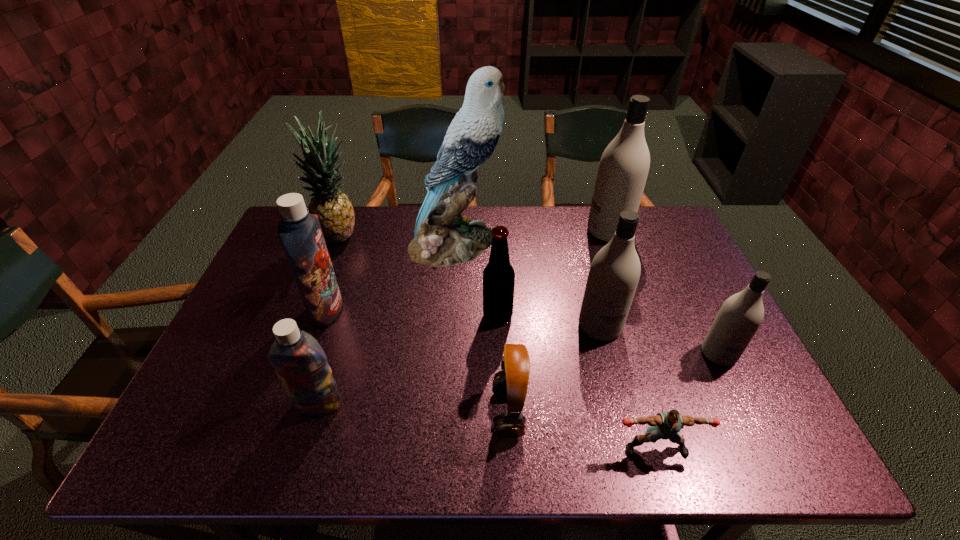
What are the coordinates of `the rightmost object` in the screenshot? It's located at (740, 316).

Where is `brown headset`? The image size is (960, 540). brown headset is located at coordinates (510, 383).

Identify the location of the second shortest object. This screenshot has width=960, height=540. (510, 383).

Find the location of a particular element. puncher is located at coordinates (665, 425).

What are the coordinates of `red puncher` in the screenshot? It's located at (665, 425).

Locate an element on the screen. The width and height of the screenshot is (960, 540). free point located on the face of the parakeet is located at coordinates (616, 243).

I want to click on blank space located on the front-facing side of the farthest shampoo, so click(x=521, y=232).

Locate an element on the screen. free location located 0.160m on the front-facing side of the farthest shampoo is located at coordinates (539, 232).

This screenshot has width=960, height=540. What are the coordinates of `free space located 0.290m on the front-facing side of the farthest shampoo` in the screenshot? It's located at (x=500, y=232).

The width and height of the screenshot is (960, 540). In order to click on vacant space situated on the right of the yellow pineapple in this screenshot , I will do `click(407, 238)`.